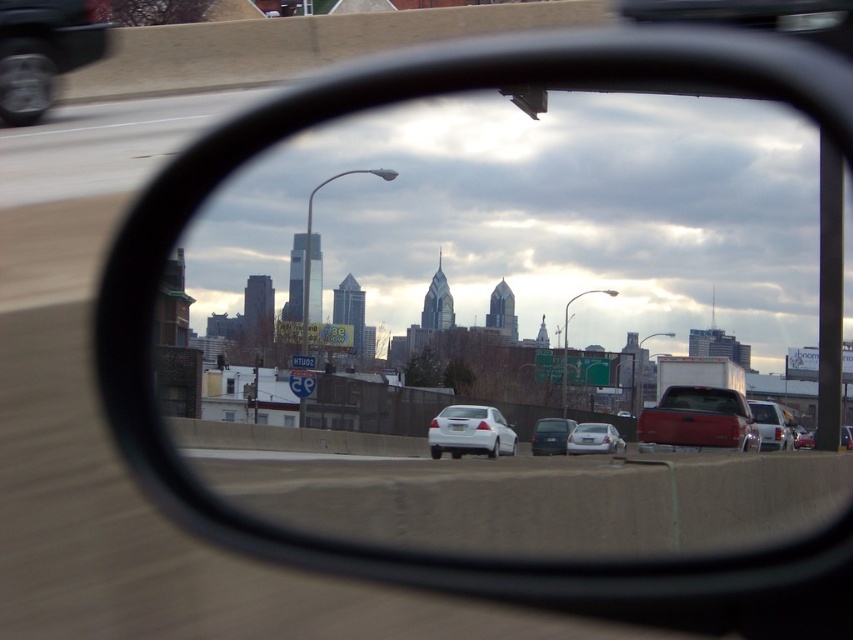
You are a driver checking your side mirror. You notice the clear glass mirror at center and the shiny red truck at center. Which object is larger in your view?

The clear glass mirror at center is bigger than the shiny red truck at center, so the clear glass mirror at center appears larger in your view.

You are a passenger in the car and looking at the side mirror. You see a white glossy sedan at center and a matte white suv at center. Which vehicle is closer to you?

The white glossy sedan at center is closer to the viewer than the matte white suv at center.

You are a passenger in the car and looking at the side mirror. You see the white glossy sedan at center and the matte white suv at center. Which one is positioned more to the left in the mirror?

The white glossy sedan at center is positioned more to the left of the matte white suv at center in the mirror.